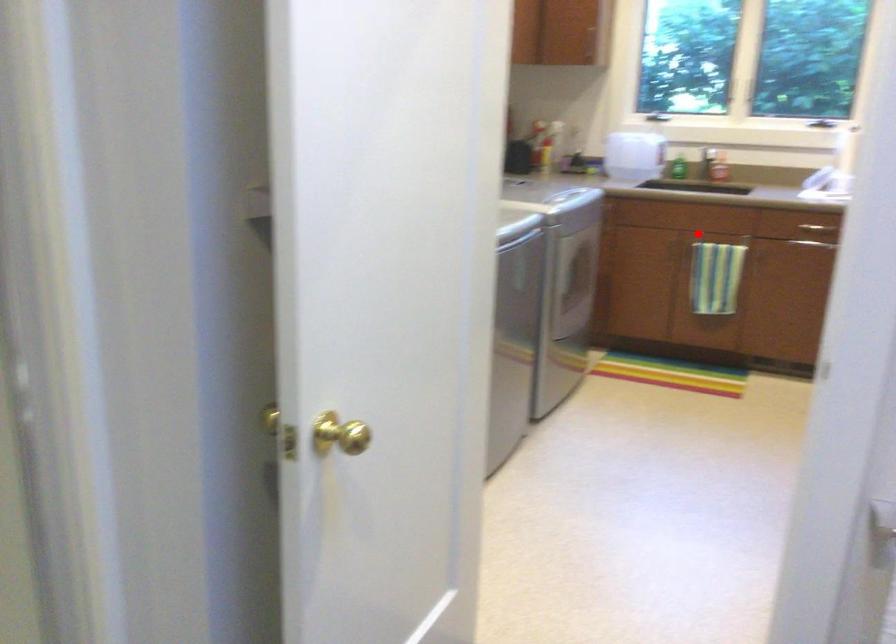
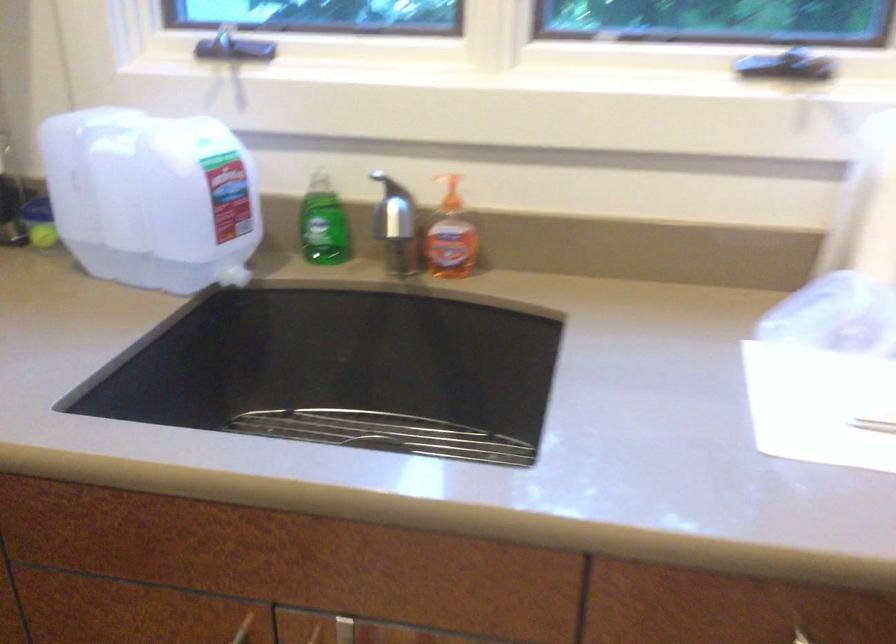
In the second image, find the point that corresponds to the highlighted location in the first image.

(343, 630)